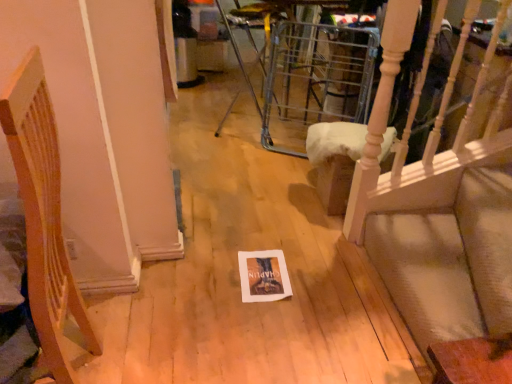
Question: Considering the positions of light wood chair at upper right, the second furniture from the front, and wooden chair at left, the 2th furniture when ordered from right to left, in the image, is light wood chair at upper right, the second furniture from the front, bigger or smaller than wooden chair at left, the 2th furniture when ordered from right to left,?

Choices:
 (A) big
 (B) small

Answer: (B)

Question: From the image's perspective, is light wood chair at upper right, the second furniture from the front, located above or below wooden chair at left, the 1th furniture positioned from the front?

Choices:
 (A) above
 (B) below

Answer: (A)

Question: Considering the positions of light wood chair at upper right, which ranks as the second furniture in left-to-right order, and wooden chair at left, the 2th furniture when ordered from right to left, in the image, is light wood chair at upper right, which ranks as the second furniture in left-to-right order, taller or shorter than wooden chair at left, the 2th furniture when ordered from right to left,?

Choices:
 (A) short
 (B) tall

Answer: (A)

Question: Considering the positions of point (61, 324) and point (358, 130), is point (61, 324) closer or farther from the camera than point (358, 130)?

Choices:
 (A) closer
 (B) farther

Answer: (A)

Question: From the image's perspective, is wooden chair at left, which is the second furniture from back to front, located above or below light wood chair at upper right, the second furniture from the front?

Choices:
 (A) above
 (B) below

Answer: (B)

Question: Choose the correct answer: Is wooden chair at left, the 1th furniture positioned from the front, inside light wood chair at upper right, which appears as the 1th furniture when viewed from the back, or outside it?

Choices:
 (A) inside
 (B) outside

Answer: (B)

Question: From a real-world perspective, is wooden chair at left, the 1th furniture positioned from the front, physically located above or below light wood chair at upper right, the second furniture from the front?

Choices:
 (A) below
 (B) above

Answer: (B)